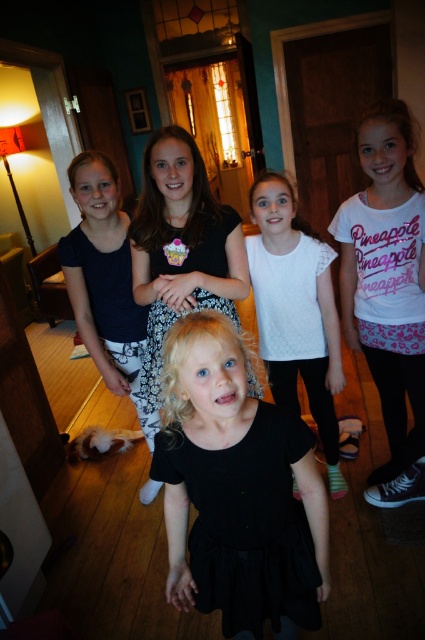
Question: Is white cotton shirt at upper right bigger than white textured shirt at center?

Choices:
 (A) no
 (B) yes

Answer: (B)

Question: Is white cotton shirt at upper right behind white textured shirt at center?

Choices:
 (A) yes
 (B) no

Answer: (B)

Question: Estimate the real-world distances between objects in this image. Which object is farther from the white cotton shirt at upper right?

Choices:
 (A) black cotton dress at center
 (B) white textured shirt at center
 (C) black matte dress at center

Answer: (C)

Question: Which object is farther from the camera taking this photo?

Choices:
 (A) black matte dress at center
 (B) white cotton shirt at upper right
 (C) black cotton dress at center
 (D) white textured shirt at center

Answer: (D)

Question: Which object is positioned farthest from the white cotton shirt at upper right?

Choices:
 (A) black cotton dress at center
 (B) white textured shirt at center

Answer: (A)

Question: In this image, where is white textured shirt at center located relative to black cotton dress at center?

Choices:
 (A) below
 (B) above

Answer: (A)